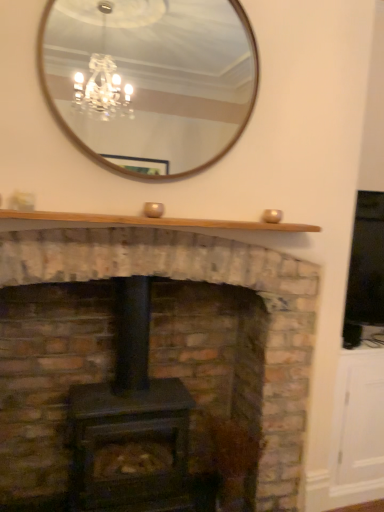
Question: From a real-world perspective, is matte black wood burning stove at center physically below natural wood mantle at upper center?

Choices:
 (A) no
 (B) yes

Answer: (B)

Question: From the image's perspective, would you say matte black wood burning stove at center is positioned over natural wood mantle at upper center?

Choices:
 (A) no
 (B) yes

Answer: (A)

Question: Is matte black wood burning stove at center oriented towards natural wood mantle at upper center?

Choices:
 (A) no
 (B) yes

Answer: (A)

Question: Can you confirm if matte black wood burning stove at center is thinner than natural wood mantle at upper center?

Choices:
 (A) no
 (B) yes

Answer: (A)

Question: Is matte black wood burning stove at center wider than natural wood mantle at upper center?

Choices:
 (A) no
 (B) yes

Answer: (B)

Question: Is point (162, 222) positioned closer to the camera than point (142, 459)?

Choices:
 (A) farther
 (B) closer

Answer: (B)

Question: Considering the positions of natural wood mantle at upper center and matte black wood burning stove at center in the image, is natural wood mantle at upper center wider or thinner than matte black wood burning stove at center?

Choices:
 (A) thin
 (B) wide

Answer: (A)

Question: Considering the positions of natural wood mantle at upper center and matte black wood burning stove at center in the image, is natural wood mantle at upper center bigger or smaller than matte black wood burning stove at center?

Choices:
 (A) small
 (B) big

Answer: (A)

Question: From the image's perspective, is natural wood mantle at upper center located above or below matte black wood burning stove at center?

Choices:
 (A) above
 (B) below

Answer: (A)

Question: Is wooden-framed mirror at upper center situated inside matte black wood burning stove at center or outside?

Choices:
 (A) inside
 (B) outside

Answer: (B)

Question: In terms of height, does wooden-framed mirror at upper center look taller or shorter compared to matte black wood burning stove at center?

Choices:
 (A) short
 (B) tall

Answer: (A)

Question: Considering the positions of point (139, 137) and point (134, 345), is point (139, 137) closer or farther from the camera than point (134, 345)?

Choices:
 (A) farther
 (B) closer

Answer: (A)

Question: Considering their positions, is wooden-framed mirror at upper center located in front of or behind matte black wood burning stove at center?

Choices:
 (A) front
 (B) behind

Answer: (A)

Question: Looking at their shapes, would you say natural wood mantle at upper center is wider or thinner than wooden-framed mirror at upper center?

Choices:
 (A) wide
 (B) thin

Answer: (A)

Question: From the image's perspective, is natural wood mantle at upper center above or below wooden-framed mirror at upper center?

Choices:
 (A) above
 (B) below

Answer: (B)